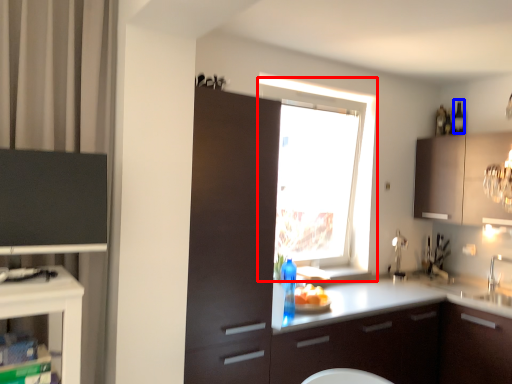
Question: Which of the following is the closest to the observer, window (highlighted by a red box) or bottle (highlighted by a blue box)?

Choices:
 (A) window
 (B) bottle

Answer: (A)